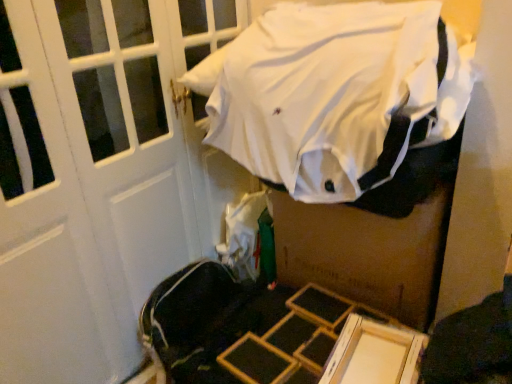
Question: From the image's perspective, is brown cardboard box at center located above or below white fabric shirt at upper center?

Choices:
 (A) below
 (B) above

Answer: (A)

Question: In terms of height, does brown cardboard box at center look taller or shorter compared to white fabric shirt at upper center?

Choices:
 (A) short
 (B) tall

Answer: (B)

Question: Do you think brown cardboard box at center is within white fabric shirt at upper center, or outside of it?

Choices:
 (A) outside
 (B) inside

Answer: (A)

Question: Do you think white fabric shirt at upper center is within brown cardboard box at center, or outside of it?

Choices:
 (A) inside
 (B) outside

Answer: (B)

Question: In the image, is white fabric shirt at upper center positioned in front of or behind brown cardboard box at center?

Choices:
 (A) front
 (B) behind

Answer: (A)

Question: In terms of height, does white fabric shirt at upper center look taller or shorter compared to brown cardboard box at center?

Choices:
 (A) short
 (B) tall

Answer: (A)

Question: Looking at their shapes, would you say white fabric shirt at upper center is wider or thinner than brown cardboard box at center?

Choices:
 (A) wide
 (B) thin

Answer: (A)